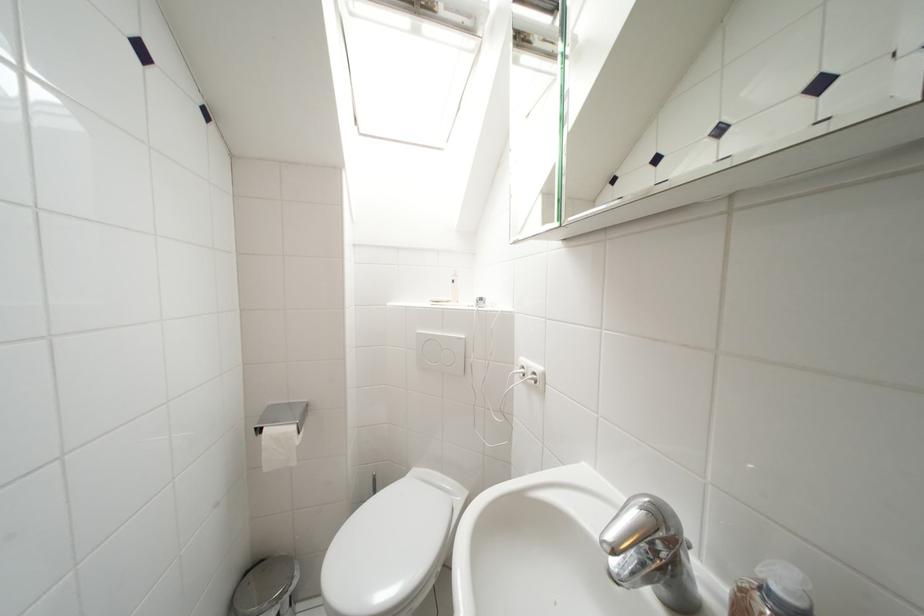
Find the location of a particular element. The height and width of the screenshot is (616, 924). chrome faucet handle is located at coordinates (650, 553).